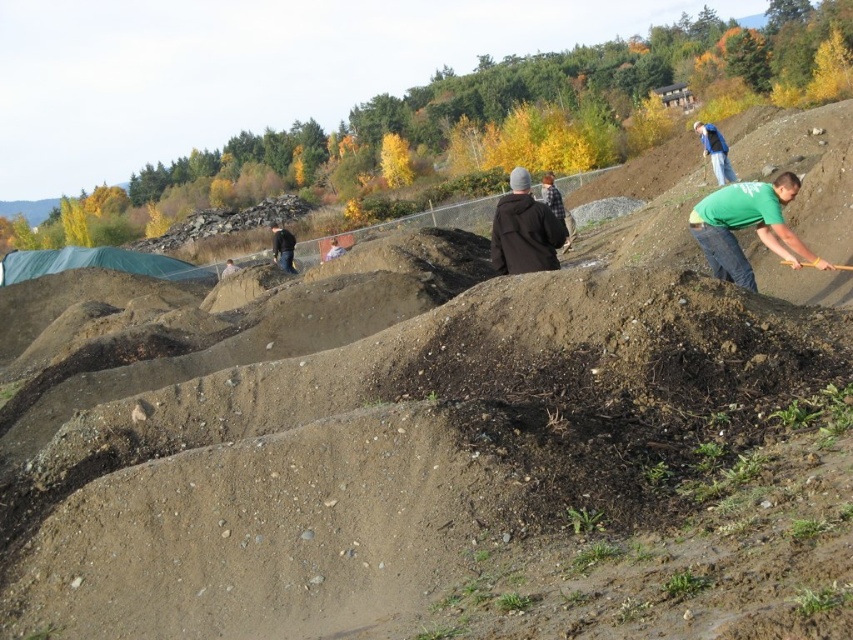
Question: Among these objects, which one is farthest from the camera?

Choices:
 (A) light brown leather jacket at center
 (B) black fabric at center

Answer: (B)

Question: Considering the relative positions of wooden shovel at right and black fabric at center in the image provided, where is wooden shovel at right located with respect to black fabric at center?

Choices:
 (A) right
 (B) left

Answer: (A)

Question: Is green matte shirt at right smaller than blue denim jeans at right?

Choices:
 (A) yes
 (B) no

Answer: (A)

Question: From the image, what is the correct spatial relationship of dark brown jacket at center in relation to light brown leather jacket at center?

Choices:
 (A) left
 (B) right

Answer: (B)

Question: Estimate the real-world distances between objects in this image. Which object is closer to the blue denim jeans at right?

Choices:
 (A) dark brown leather jacket at center
 (B) light brown leather jacket at center
 (C) dark brown jacket at center
 (D) black fabric at center

Answer: (C)

Question: Based on their relative distances, which object is nearer to the wooden shovel at right?

Choices:
 (A) green matte shirt at right
 (B) blue denim jeans at right

Answer: (A)